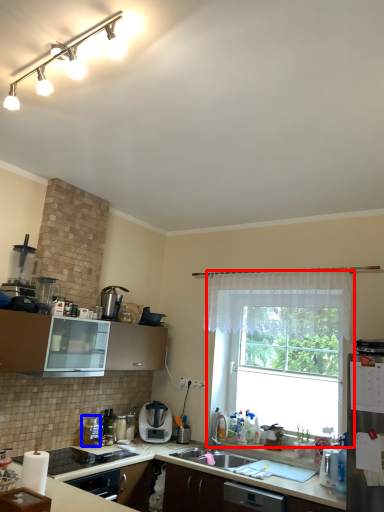
Question: Which object is closer to the camera taking this photo, window (highlighted by a red box) or appliance (highlighted by a blue box)?

Choices:
 (A) window
 (B) appliance

Answer: (A)